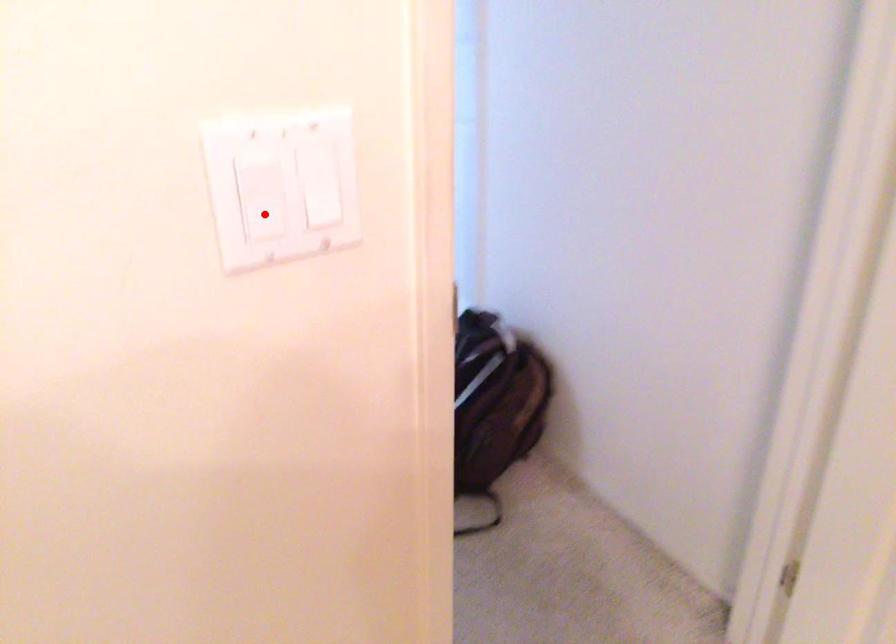
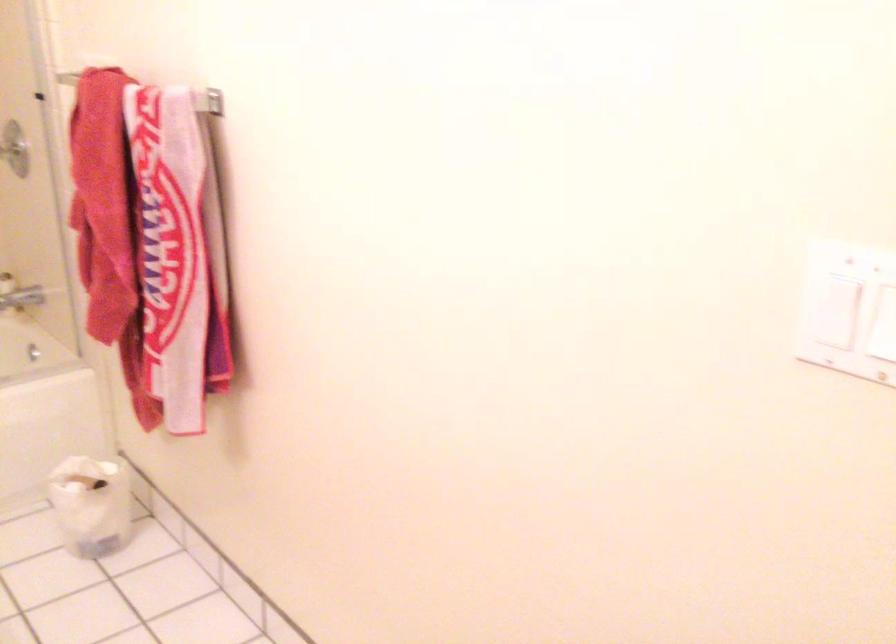
Question: I am providing you with two images of the same scene from different viewpoints. Given a red point in image1, look at the same physical point in image2. Is it:

Choices:
 (A) Closer to the viewpoint
 (B) Farther from the viewpoint

Answer: (B)